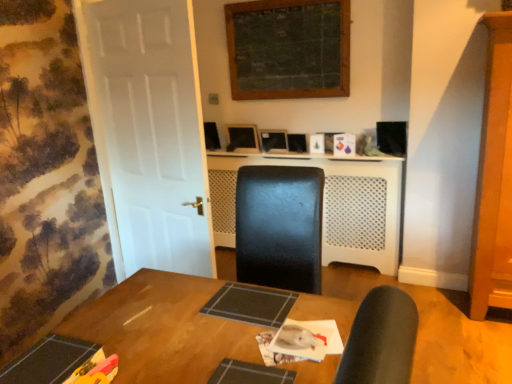
What do you see at coordinates (148, 132) in the screenshot? I see `white matte door at left` at bounding box center [148, 132].

In order to face matte black monitor at center, should I rotate leftwards or rightwards?

It's best to rotate left around 1.570 degrees.

This screenshot has height=384, width=512. What do you see at coordinates (328, 204) in the screenshot?
I see `white perforated plastic at center` at bounding box center [328, 204].

Identify the location of white matte door at left. (148, 132).

Is the depth of white matte door at left less than that of wooden table at center?

No, the depth of white matte door at left is greater than that of wooden table at center.

Based on their positions, is white matte door at left located to the left or right of wooden table at center?

From the image, it's evident that white matte door at left is to the left of wooden table at center.

Identify the location of door above the wooden table at center (from the image's perspective). The image size is (512, 384). pyautogui.click(x=148, y=132).

Is white matte door at left turned away from wooden table at center?

No, white matte door at left's orientation is not away from wooden table at center.

Find the location of `door located above the white perforated plastic at center (from the image's perspective)`. door located above the white perforated plastic at center (from the image's perspective) is located at coordinates (148, 132).

Is white perforated plastic at center beside white matte door at left?

No.

Between white perforated plastic at center and white matte door at left, which one has less height?

With less height is white perforated plastic at center.

How many degrees apart are the facing directions of wooden table at center and matte black monitor at center?

The angular difference between wooden table at center and matte black monitor at center is 88 degrees.

Which of these two, wooden table at center or matte black monitor at center, is bigger?

wooden table at center.

Which is closer, (324,367) or (244,126)?

Point (324,367) is positioned closer to the camera compared to point (244,126).

Considering the positions of objects wooden table at center and matte black monitor at center in the image provided, who is more to the right, wooden table at center or matte black monitor at center?

From the viewer's perspective, wooden table at center appears more on the right side.

Considering the relative positions of matte black monitor at center and white perforated plastic at center in the image provided, is matte black monitor at center to the right of white perforated plastic at center from the viewer's perspective?

No.

Is matte black monitor at center behind white perforated plastic at center?

Yes, it is behind white perforated plastic at center.

Between matte black monitor at center and white perforated plastic at center, which one has larger size?

Bigger between the two is white perforated plastic at center.

From a real-world perspective, who is located lower, white matte door at left or matte black monitor at center?

matte black monitor at center, from a real-world perspective.

How much distance is there between white matte door at left and matte black monitor at center?

white matte door at left and matte black monitor at center are 1.15 meters apart from each other.

Is white matte door at left positioned with its back to matte black monitor at center?

Yes.

Locate an element on the screen. The width and height of the screenshot is (512, 384). computer monitor below the white matte door at left (from a real-world perspective) is located at coordinates (242, 137).

Do you think white perforated plastic at center is within matte black monitor at center, or outside of it?

white perforated plastic at center is not enclosed by matte black monitor at center.

From a real-world perspective, is white perforated plastic at center beneath matte black monitor at center?

Yes, from a real-world perspective, white perforated plastic at center is under matte black monitor at center.

Is white perforated plastic at center looking in the opposite direction of matte black monitor at center?

No, matte black monitor at center is not at the back of white perforated plastic at center.

Is white perforated plastic at center with matte black monitor at center?

They are not placed beside each other.

Based on the photo, can we say matte black monitor at center lies outside white matte door at left?

matte black monitor at center is positioned outside white matte door at left.

Identify the location of computer monitor above the white matte door at left (from the image's perspective). The width and height of the screenshot is (512, 384). (242, 137).

Relative to white matte door at left, is matte black monitor at center in front or behind?

In the image, matte black monitor at center appears behind white matte door at left.

Find the location of a particular element. Image resolution: width=512 pixels, height=384 pixels. table on the right of the white matte door at left is located at coordinates (163, 329).

The width and height of the screenshot is (512, 384). In order to click on computer desk that appears below the white matte door at left (from the image's perspective) in this screenshot , I will do `click(328, 204)`.

Looking at the image, which one is located closer to matte black monitor at center, wooden table at center or white perforated plastic at center?

white perforated plastic at center is closer to matte black monitor at center.

Looking at the image, which one is located further to white matte door at left, matte black monitor at center or white perforated plastic at center?

The object further to white matte door at left is matte black monitor at center.

Looking at the image, which one is located further to matte black monitor at center, white perforated plastic at center or white matte door at left?

white matte door at left.

From the image, which object appears to be nearer to wooden table at center, matte black monitor at center or white perforated plastic at center?

Among the two, white perforated plastic at center is located nearer to wooden table at center.

Consider the image. Based on their spatial positions, is white perforated plastic at center or wooden table at center further from white matte door at left?

white perforated plastic at center is positioned further to the anchor white matte door at left.

Considering their positions, is matte black monitor at center positioned further to white perforated plastic at center than white matte door at left?

The object further to white perforated plastic at center is white matte door at left.

Looking at the image, which one is located further to wooden table at center, white perforated plastic at center or matte black monitor at center?

matte black monitor at center.

Considering their positions, is wooden table at center positioned closer to matte black monitor at center than white matte door at left?

white matte door at left.

Where is `computer desk between wooden table at center and matte black monitor at center along the z-axis`? Image resolution: width=512 pixels, height=384 pixels. computer desk between wooden table at center and matte black monitor at center along the z-axis is located at coordinates tap(328, 204).

I want to click on computer desk between white matte door at left and matte black monitor at center from front to back, so click(x=328, y=204).

This screenshot has height=384, width=512. In order to click on door positioned between wooden table at center and matte black monitor at center from near to far in this screenshot , I will do `click(148, 132)`.

Image resolution: width=512 pixels, height=384 pixels. I want to click on door positioned between wooden table at center and white perforated plastic at center from near to far, so click(x=148, y=132).